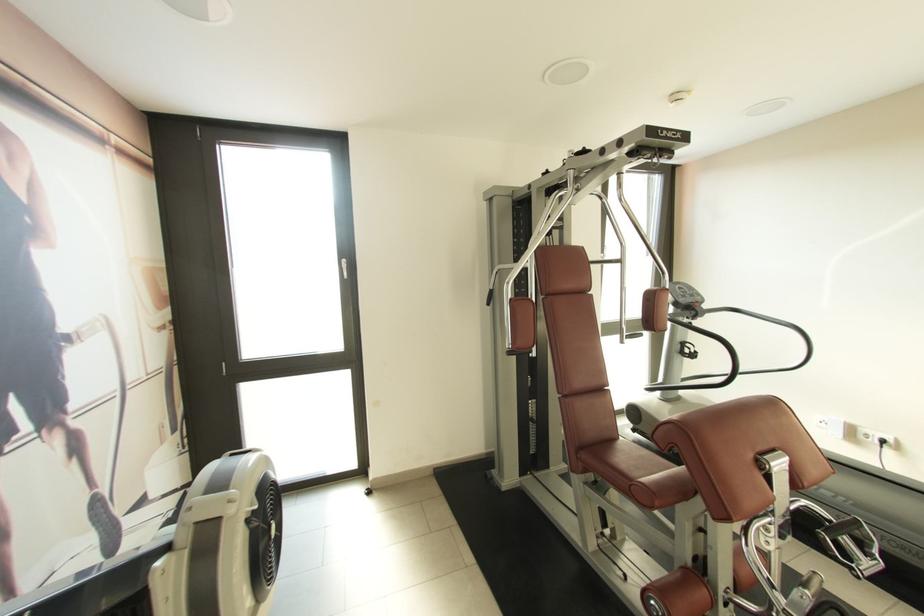
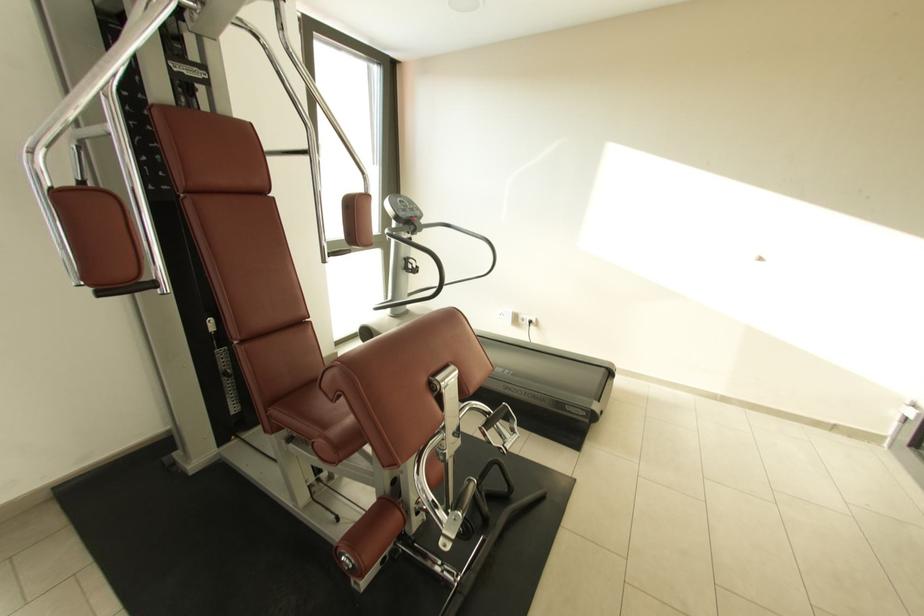
Question: How did the camera likely rotate?

Choices:
 (A) Left
 (B) Right
 (C) Up
 (D) Down

Answer: (B)